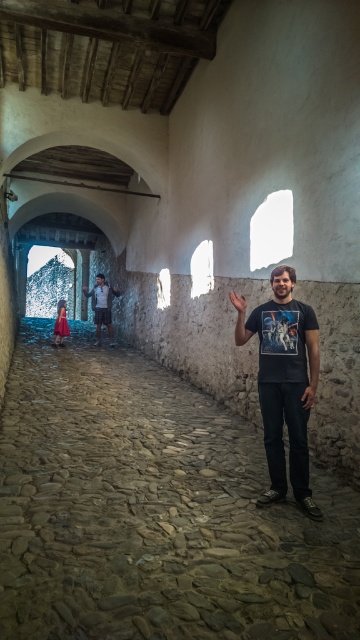
Question: Does smooth stone floor at center appear on the left side of matte red dress at far left?

Choices:
 (A) no
 (B) yes

Answer: (A)

Question: Which object is the farthest from the light blue denim shorts at center?

Choices:
 (A) matte red dress at far left
 (B) black matte t-shirt at center
 (C) smooth stone floor at center

Answer: (C)

Question: Observing the image, what is the correct spatial positioning of smooth stone floor at center in reference to black matte t-shirt at center?

Choices:
 (A) right
 (B) left

Answer: (A)

Question: Estimate the real-world distances between objects in this image. Which object is closer to the matte red dress at far left?

Choices:
 (A) light blue denim shorts at center
 (B) black matte t-shirt at center
 (C) smooth stone floor at center

Answer: (A)

Question: Among these points, which one is farthest from the camera?

Choices:
 (A) (92, 296)
 (B) (56, 326)
 (C) (33, 500)

Answer: (A)

Question: Is black matte t-shirt at center above light blue denim shorts at center?

Choices:
 (A) no
 (B) yes

Answer: (A)